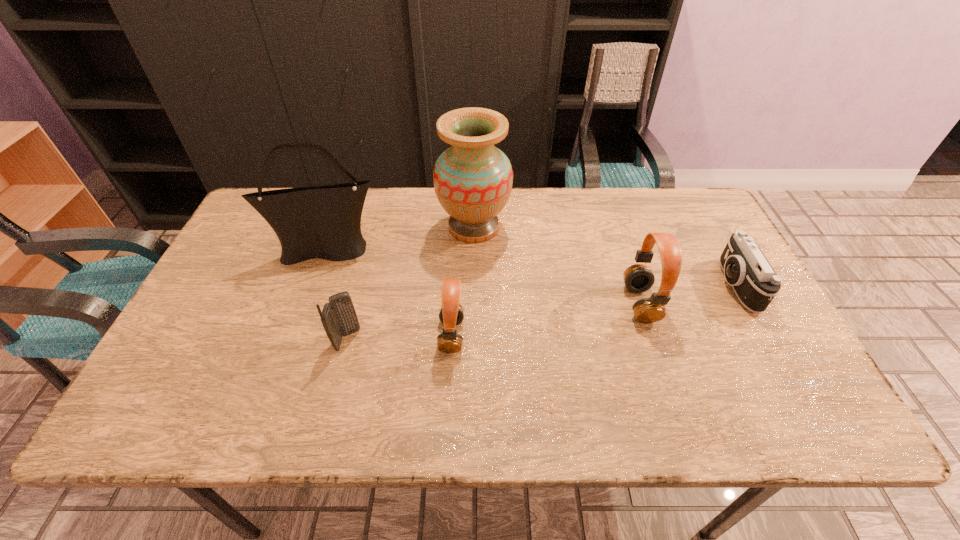
Locate an element on the screen. vacant space located on the ear cups of the left headset is located at coordinates (310, 335).

The width and height of the screenshot is (960, 540). I want to click on free location located 0.380m on the ear cups of the second object from right to left, so click(478, 303).

Where is `free space located 0.120m on the ear cups of the second object from right to left`? The height and width of the screenshot is (540, 960). free space located 0.120m on the ear cups of the second object from right to left is located at coordinates (579, 303).

Identify the location of free space located on the ear cups of the second object from right to left. (583, 303).

This screenshot has width=960, height=540. I want to click on vacant space located 0.100m on the right of the vase, so click(543, 227).

The height and width of the screenshot is (540, 960). Find the location of `free space located 0.140m on the back of the shoulder bag`. free space located 0.140m on the back of the shoulder bag is located at coordinates (342, 207).

Identify the location of vacant space situated on the front lens of the shortest object. This screenshot has width=960, height=540. (660, 285).

Find the location of a particular element. The height and width of the screenshot is (540, 960). free spot located 0.060m on the front lens of the shortest object is located at coordinates (696, 285).

I want to click on free region located 0.210m on the front lens of the shortest object, so click(x=640, y=285).

Where is `vacant space located on the keyboard of the cellular telephone`? Image resolution: width=960 pixels, height=540 pixels. vacant space located on the keyboard of the cellular telephone is located at coordinates (471, 339).